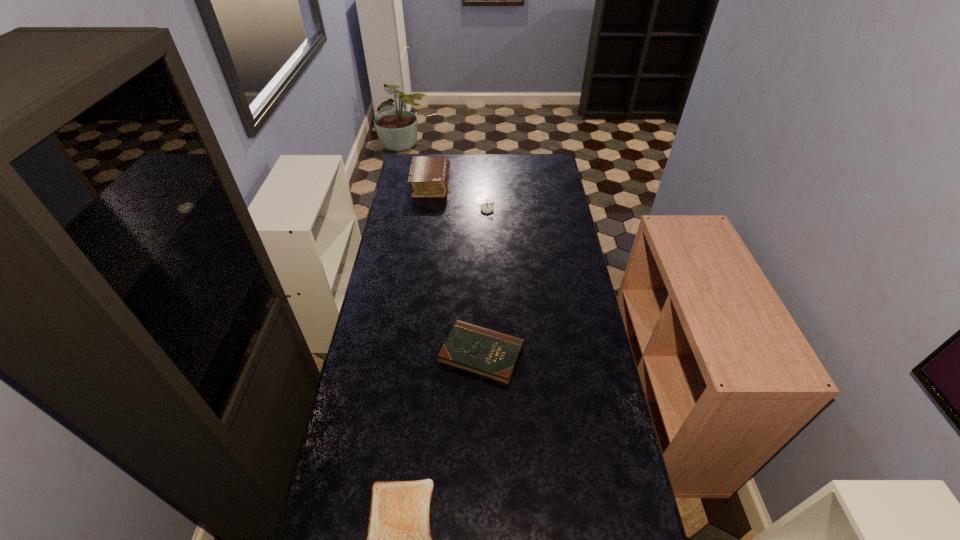
Where is `the left Bible`? This screenshot has width=960, height=540. the left Bible is located at coordinates (429, 175).

Where is `the taller Bible`? The image size is (960, 540). the taller Bible is located at coordinates (429, 175).

Locate an element on the screen. The width and height of the screenshot is (960, 540). compass is located at coordinates (486, 207).

Find the location of a particular element. This screenshot has width=960, height=540. the second farthest object is located at coordinates pos(486,207).

Identify the location of the nearer Bible. (491, 354).

Locate an element on the screen. The width and height of the screenshot is (960, 540). the right Bible is located at coordinates (491, 354).

You are a GUI agent. You are given a task and a screenshot of the screen. Output one action in this format:
    pyautogui.click(x=<x>, y=<y>)
    Task: Click on the free spot located 0.060m on the spine side of the tallest object
    
    Given the screenshot: What is the action you would take?
    pyautogui.click(x=461, y=185)

You are a GUI agent. You are given a task and a screenshot of the screen. Output one action in this format:
    pyautogui.click(x=<x>, y=<y>)
    Task: Click on the vacant space situated 0.300m on the right of the third nearest object
    
    Given the screenshot: What is the action you would take?
    click(556, 209)

Find the location of a particular element. The image size is (960, 540). vacant region located on the back of the shorter Bible is located at coordinates (481, 302).

Find the location of `object that is at the far edge`. object that is at the far edge is located at coordinates (429, 175).